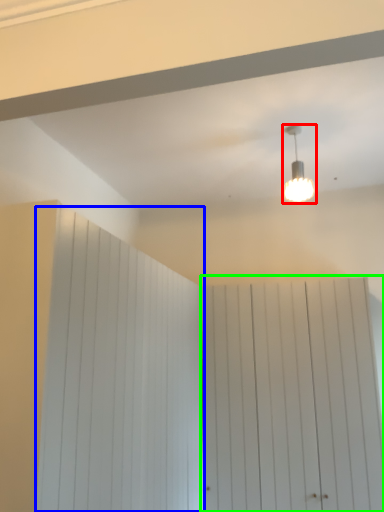
Question: Estimate the real-world distances between objects in this image. Which object is closer to lamp (highlighted by a red box), barn door (highlighted by a blue box) or barn door (highlighted by a green box)?

Choices:
 (A) barn door
 (B) barn door

Answer: (B)